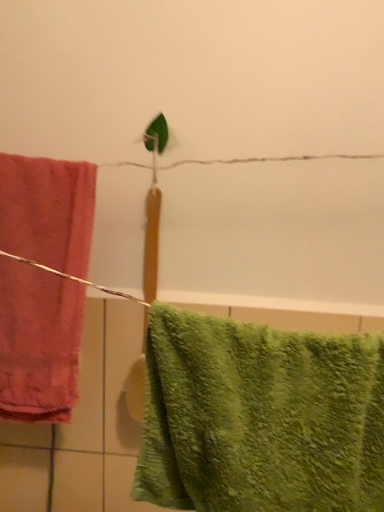
Identify the location of matte pink towel at left, the 1th towel in the back-to-front sequence. (38, 343).

What do you see at coordinates (38, 343) in the screenshot?
I see `matte pink towel at left, marked as the 1th towel in a left-to-right arrangement` at bounding box center [38, 343].

Where is `green fuzzy towel at lower right, which ranks as the first towel in front-to-back order`? This screenshot has height=512, width=384. green fuzzy towel at lower right, which ranks as the first towel in front-to-back order is located at coordinates (260, 418).

The image size is (384, 512). What do you see at coordinates (260, 418) in the screenshot?
I see `green fuzzy towel at lower right, marked as the 2th towel in a left-to-right arrangement` at bounding box center [260, 418].

Image resolution: width=384 pixels, height=512 pixels. What are the coordinates of `matte pink towel at left, which is counted as the 2th towel, starting from the front` in the screenshot? It's located at (38, 343).

Considering the relative positions of green fuzzy towel at lower right, marked as the 2th towel in a left-to-right arrangement, and matte pink towel at left, marked as the 1th towel in a left-to-right arrangement, in the image provided, is green fuzzy towel at lower right, marked as the 2th towel in a left-to-right arrangement, to the left or to the right of matte pink towel at left, marked as the 1th towel in a left-to-right arrangement,?

green fuzzy towel at lower right, marked as the 2th towel in a left-to-right arrangement, is to the right of matte pink towel at left, marked as the 1th towel in a left-to-right arrangement.

Which object is closer to the camera taking this photo, green fuzzy towel at lower right, placed as the 2th towel when sorted from back to front, or matte pink towel at left, marked as the 1th towel in a left-to-right arrangement?

green fuzzy towel at lower right, placed as the 2th towel when sorted from back to front, is closer to the camera.

Which is farther from the camera, (364, 340) or (52, 405)?

The point (52, 405) is more distant.

From the image's perspective, does green fuzzy towel at lower right, placed as the 2th towel when sorted from back to front, appear lower than matte pink towel at left, arranged as the 2th towel when viewed from the right?

Yes, from the image's perspective, green fuzzy towel at lower right, placed as the 2th towel when sorted from back to front, is below matte pink towel at left, arranged as the 2th towel when viewed from the right.

From a real-world perspective, between green fuzzy towel at lower right, placed as the 2th towel when sorted from back to front, and matte pink towel at left, arranged as the 2th towel when viewed from the right, who is vertically higher?

From a 3D spatial view, matte pink towel at left, arranged as the 2th towel when viewed from the right, is above.

Which of these two, green fuzzy towel at lower right, which ranks as the first towel in front-to-back order, or matte pink towel at left, which is counted as the 2th towel, starting from the front, is thinner?

Thinner between the two is matte pink towel at left, which is counted as the 2th towel, starting from the front.

Is green fuzzy towel at lower right, marked as the 2th towel in a left-to-right arrangement, taller than matte pink towel at left, arranged as the 2th towel when viewed from the right?

Incorrect, the height of green fuzzy towel at lower right, marked as the 2th towel in a left-to-right arrangement, is not larger of that of matte pink towel at left, arranged as the 2th towel when viewed from the right.

Is green fuzzy towel at lower right, which ranks as the first towel in front-to-back order, smaller than matte pink towel at left, the 1th towel in the back-to-front sequence?

No, green fuzzy towel at lower right, which ranks as the first towel in front-to-back order, is not smaller than matte pink towel at left, the 1th towel in the back-to-front sequence.

Is green fuzzy towel at lower right, marked as the 2th towel in a left-to-right arrangement, located outside matte pink towel at left, marked as the 1th towel in a left-to-right arrangement?

Yes, green fuzzy towel at lower right, marked as the 2th towel in a left-to-right arrangement, is outside of matte pink towel at left, marked as the 1th towel in a left-to-right arrangement.

Are green fuzzy towel at lower right, arranged as the first towel when viewed from the right, and matte pink towel at left, marked as the 1th towel in a left-to-right arrangement, beside each other?

No, green fuzzy towel at lower right, arranged as the first towel when viewed from the right, is not touching matte pink towel at left, marked as the 1th towel in a left-to-right arrangement.

Is matte pink towel at left, which is counted as the 2th towel, starting from the front, at the back of green fuzzy towel at lower right, marked as the 2th towel in a left-to-right arrangement?

No, green fuzzy towel at lower right, marked as the 2th towel in a left-to-right arrangement, is not facing away from matte pink towel at left, which is counted as the 2th towel, starting from the front.

How different are the orientations of green fuzzy towel at lower right, arranged as the first towel when viewed from the right, and matte pink towel at left, marked as the 1th towel in a left-to-right arrangement, in degrees?

0.00705 degrees separate the facing orientations of green fuzzy towel at lower right, arranged as the first towel when viewed from the right, and matte pink towel at left, marked as the 1th towel in a left-to-right arrangement.

You are a GUI agent. You are given a task and a screenshot of the screen. Output one action in this format:
    pyautogui.click(x=<x>, y=<y>)
    Task: Click on the towel lying on the right of matte pink towel at left, the 1th towel in the back-to-front sequence
    
    Given the screenshot: What is the action you would take?
    pyautogui.click(x=260, y=418)

Which object is positioned more to the left, matte pink towel at left, the 1th towel in the back-to-front sequence, or green fuzzy towel at lower right, which ranks as the first towel in front-to-back order?

Positioned to the left is matte pink towel at left, the 1th towel in the back-to-front sequence.

Considering the positions of objects matte pink towel at left, marked as the 1th towel in a left-to-right arrangement, and green fuzzy towel at lower right, placed as the 2th towel when sorted from back to front, in the image provided, who is in front, matte pink towel at left, marked as the 1th towel in a left-to-right arrangement, or green fuzzy towel at lower right, placed as the 2th towel when sorted from back to front,?

Positioned in front is green fuzzy towel at lower right, placed as the 2th towel when sorted from back to front.

Considering the points (30, 297) and (229, 321), which point is behind, point (30, 297) or point (229, 321)?

The point (30, 297) is farther.

From the image's perspective, is matte pink towel at left, which is counted as the 2th towel, starting from the front, located beneath green fuzzy towel at lower right, which ranks as the first towel in front-to-back order?

Incorrect, from the image's perspective, matte pink towel at left, which is counted as the 2th towel, starting from the front, is higher than green fuzzy towel at lower right, which ranks as the first towel in front-to-back order.

From a real-world perspective, is matte pink towel at left, which is counted as the 2th towel, starting from the front, physically below green fuzzy towel at lower right, marked as the 2th towel in a left-to-right arrangement?

No, from a real-world perspective, matte pink towel at left, which is counted as the 2th towel, starting from the front, is not beneath green fuzzy towel at lower right, marked as the 2th towel in a left-to-right arrangement.

Looking at their sizes, would you say matte pink towel at left, which is counted as the 2th towel, starting from the front, is wider or thinner than green fuzzy towel at lower right, marked as the 2th towel in a left-to-right arrangement?

Considering their sizes, matte pink towel at left, which is counted as the 2th towel, starting from the front, looks slimmer than green fuzzy towel at lower right, marked as the 2th towel in a left-to-right arrangement.

Is matte pink towel at left, the 1th towel in the back-to-front sequence, taller or shorter than green fuzzy towel at lower right, which ranks as the first towel in front-to-back order?

matte pink towel at left, the 1th towel in the back-to-front sequence, is taller than green fuzzy towel at lower right, which ranks as the first towel in front-to-back order.

Based on their sizes in the image, would you say matte pink towel at left, the 1th towel in the back-to-front sequence, is bigger or smaller than green fuzzy towel at lower right, marked as the 2th towel in a left-to-right arrangement?

In the image, matte pink towel at left, the 1th towel in the back-to-front sequence, appears to be smaller than green fuzzy towel at lower right, marked as the 2th towel in a left-to-right arrangement.

In the scene shown: Would you say matte pink towel at left, which is counted as the 2th towel, starting from the front, contains green fuzzy towel at lower right, marked as the 2th towel in a left-to-right arrangement?

No, matte pink towel at left, which is counted as the 2th towel, starting from the front, does not contain green fuzzy towel at lower right, marked as the 2th towel in a left-to-right arrangement.

Are matte pink towel at left, the 1th towel in the back-to-front sequence, and green fuzzy towel at lower right, which ranks as the first towel in front-to-back order, located far from each other?

matte pink towel at left, the 1th towel in the back-to-front sequence, is actually quite close to green fuzzy towel at lower right, which ranks as the first towel in front-to-back order.

Is matte pink towel at left, marked as the 1th towel in a left-to-right arrangement, oriented towards green fuzzy towel at lower right, marked as the 2th towel in a left-to-right arrangement?

No, matte pink towel at left, marked as the 1th towel in a left-to-right arrangement, is not turned towards green fuzzy towel at lower right, marked as the 2th towel in a left-to-right arrangement.

What's the angular difference between matte pink towel at left, marked as the 1th towel in a left-to-right arrangement, and green fuzzy towel at lower right, arranged as the first towel when viewed from the right,'s facing directions?

0.00705 degrees.

How much distance is there between matte pink towel at left, arranged as the 2th towel when viewed from the right, and green fuzzy towel at lower right, which ranks as the first towel in front-to-back order?

matte pink towel at left, arranged as the 2th towel when viewed from the right, and green fuzzy towel at lower right, which ranks as the first towel in front-to-back order, are 13.57 inches apart from each other.

At what (x,y) coordinates should I click in order to perform the action: click on towel below the matte pink towel at left, marked as the 1th towel in a left-to-right arrangement (from a real-world perspective). Please return your answer as a coordinate pair (x, y). This screenshot has height=512, width=384. Looking at the image, I should click on (260, 418).

Find the location of a particular element. Image resolution: width=384 pixels, height=512 pixels. towel below the matte pink towel at left, marked as the 1th towel in a left-to-right arrangement (from the image's perspective) is located at coordinates (260, 418).

Identify the location of towel to the right of matte pink towel at left, marked as the 1th towel in a left-to-right arrangement. (260, 418).